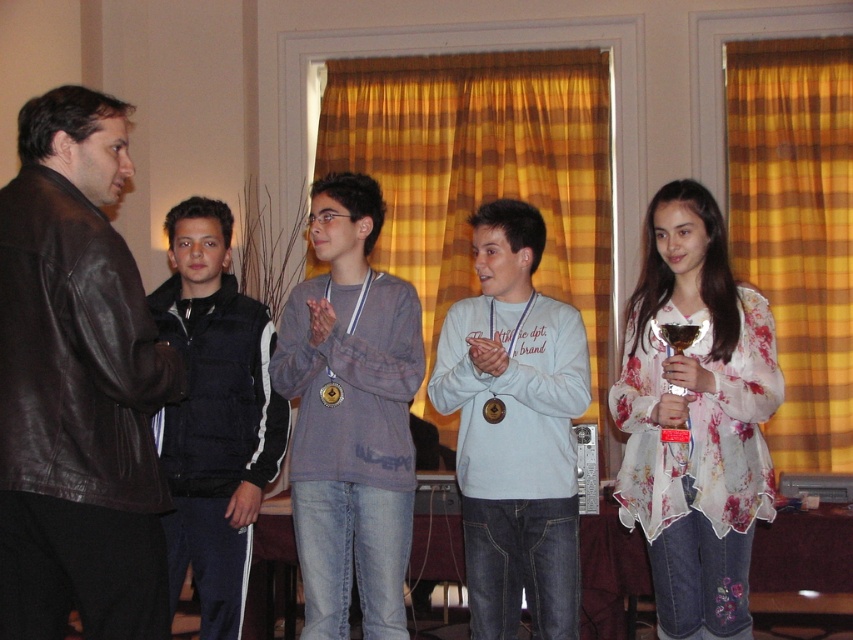
Measure the distance from brown leather jacket at left to floral sheer blouse at center.

A distance of 5.17 feet exists between brown leather jacket at left and floral sheer blouse at center.

Does brown leather jacket at left have a smaller size compared to floral sheer blouse at center?

Correct, brown leather jacket at left occupies less space than floral sheer blouse at center.

Is point (51, 186) more distant than point (698, 550)?

No, (51, 186) is in front of (698, 550).

You are a GUI agent. You are given a task and a screenshot of the screen. Output one action in this format:
    pyautogui.click(x=<x>, y=<y>)
    Task: Click on the brown leather jacket at left
    This screenshot has height=640, width=853.
    Given the screenshot: What is the action you would take?
    pyautogui.click(x=77, y=385)

Is brown leather jacket at left positioned behind light blue cotton shirt at center?

That is False.

Can you confirm if brown leather jacket at left is positioned to the left of light blue cotton shirt at center?

Yes, brown leather jacket at left is to the left of light blue cotton shirt at center.

In order to click on brown leather jacket at left in this screenshot , I will do `click(77, 385)`.

Is floral sheer blouse at center wider than matte gray sweater at center?

Incorrect, floral sheer blouse at center's width does not surpass matte gray sweater at center's.

Is point (648, 504) farther from viewer compared to point (289, 460)?

That is False.

Locate an element on the screen. Image resolution: width=853 pixels, height=640 pixels. floral sheer blouse at center is located at coordinates (695, 417).